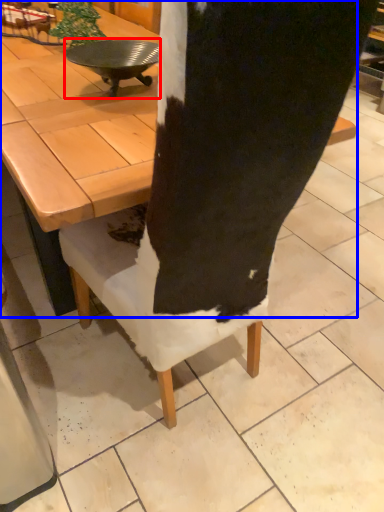
Question: Which object appears closest to the camera in this image, round table (highlighted by a red box) or coffee table (highlighted by a blue box)?

Choices:
 (A) round table
 (B) coffee table

Answer: (B)